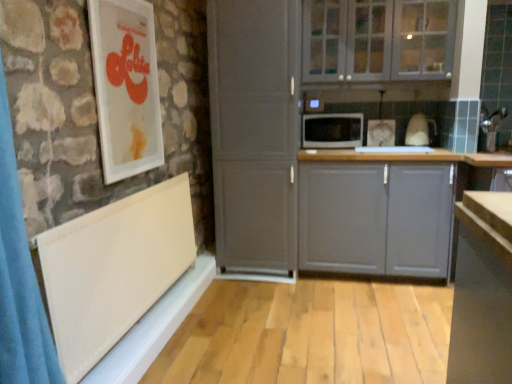
Question: From the image's perspective, is white textured window sill at lower left above black matte microwave at center?

Choices:
 (A) no
 (B) yes

Answer: (A)

Question: From a real-world perspective, is white textured window sill at lower left located higher than black matte microwave at center?

Choices:
 (A) no
 (B) yes

Answer: (A)

Question: Is white textured window sill at lower left taller than black matte microwave at center?

Choices:
 (A) yes
 (B) no

Answer: (B)

Question: Is white textured window sill at lower left oriented towards black matte microwave at center?

Choices:
 (A) yes
 (B) no

Answer: (B)

Question: Considering the relative positions of white textured window sill at lower left and black matte microwave at center in the image provided, is white textured window sill at lower left behind black matte microwave at center?

Choices:
 (A) yes
 (B) no

Answer: (B)

Question: From the image's perspective, is white textured window sill at lower left below black matte microwave at center?

Choices:
 (A) yes
 (B) no

Answer: (A)

Question: Considering the relative positions of white textured window sill at lower left and white glass cabinets at upper center, which appears as the 1th cabinetry when viewed from the top, in the image provided, is white textured window sill at lower left in front of white glass cabinets at upper center, which appears as the 1th cabinetry when viewed from the top,?

Choices:
 (A) yes
 (B) no

Answer: (A)

Question: From a real-world perspective, is white textured window sill at lower left beneath white glass cabinets at upper center, which appears as the 1th cabinetry when viewed from the top?

Choices:
 (A) no
 (B) yes

Answer: (B)

Question: Would you say white textured window sill at lower left is a long distance from white glass cabinets at upper center, which appears as the 1th cabinetry when viewed from the top?

Choices:
 (A) yes
 (B) no

Answer: (A)

Question: Could you tell me if white textured window sill at lower left is turned towards white glass cabinets at upper center, which appears as the 1th cabinetry when viewed from the top?

Choices:
 (A) yes
 (B) no

Answer: (B)

Question: From a real-world perspective, is white textured window sill at lower left on top of white glass cabinets at upper center, which appears as the 1th cabinetry when viewed from the top?

Choices:
 (A) yes
 (B) no

Answer: (B)

Question: Is white textured window sill at lower left thinner than white glass cabinets at upper center, which appears as the 1th cabinetry when viewed from the top?

Choices:
 (A) no
 (B) yes

Answer: (B)

Question: Is white textured window sill at lower left thinner than white glossy picture frame at upper left?

Choices:
 (A) yes
 (B) no

Answer: (B)